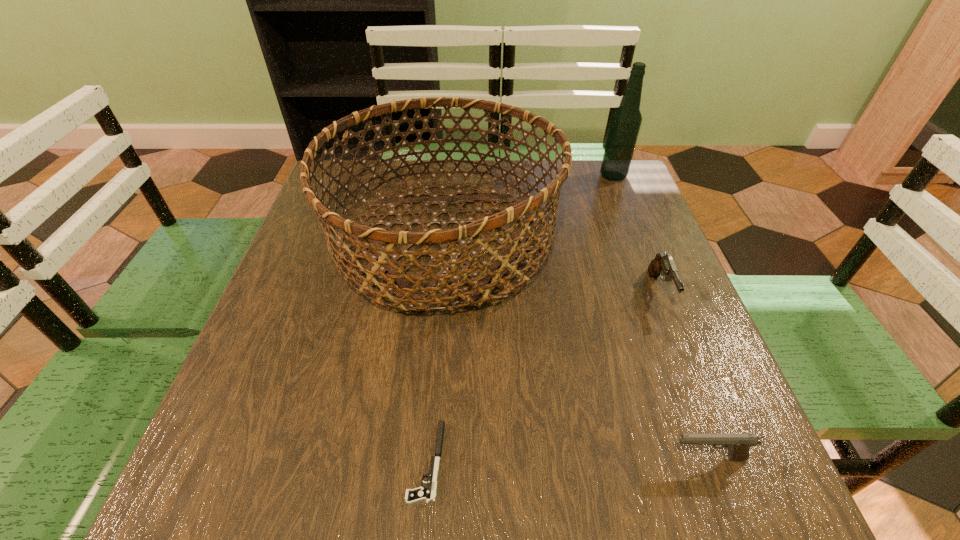
The width and height of the screenshot is (960, 540). I want to click on object that is at the far right corner, so click(x=626, y=120).

The width and height of the screenshot is (960, 540). Identify the location of object located at the near right corner. (738, 445).

Identify the location of free spot at the far edge of the desktop. The image size is (960, 540). (530, 181).

Image resolution: width=960 pixels, height=540 pixels. In the image, there is a desktop. Find the location of `vacant space at the left edge`. vacant space at the left edge is located at coordinates (277, 319).

Find the location of `vacant space at the right edge of the desktop`. vacant space at the right edge of the desktop is located at coordinates (653, 324).

Identify the location of blank space at the near left corner of the desktop. This screenshot has width=960, height=540. (225, 474).

This screenshot has height=540, width=960. I want to click on vacant space at the far right corner, so click(x=646, y=201).

Locate an element on the screen. free space that is in between the second tallest object and the shortest object is located at coordinates (435, 349).

This screenshot has height=540, width=960. I want to click on free point between the farthest pistol and the shortest object, so pyautogui.click(x=543, y=376).

Image resolution: width=960 pixels, height=540 pixels. Find the location of `free area in between the shortest object and the tallest object`. free area in between the shortest object and the tallest object is located at coordinates (519, 319).